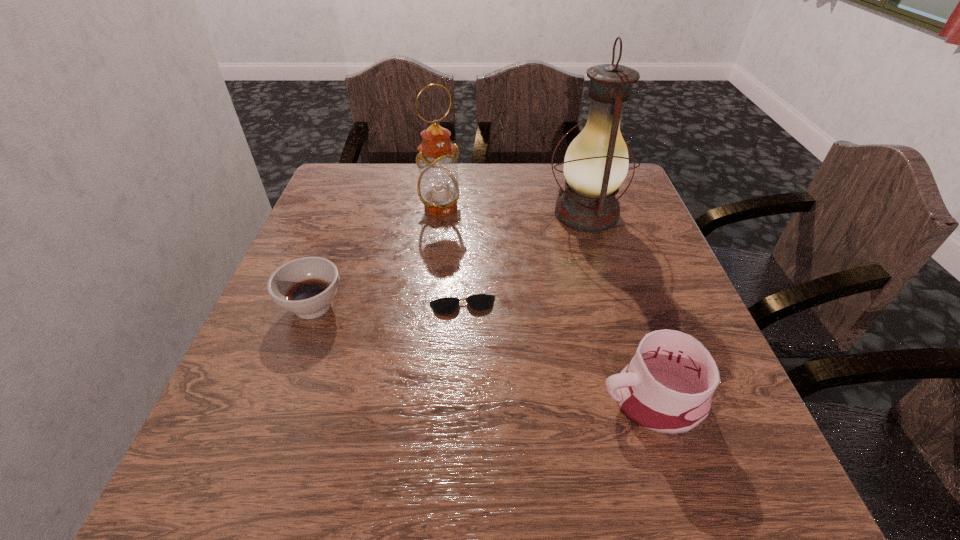
Where is `free space located 0.130m on the front of the shorter oil lamp`? free space located 0.130m on the front of the shorter oil lamp is located at coordinates (435, 252).

Locate an element on the screen. The image size is (960, 540). vacant region located 0.140m on the side with the handle of the third shortest object is located at coordinates (516, 400).

The width and height of the screenshot is (960, 540). In order to click on blank space located on the side with the handle of the third shortest object in this screenshot , I will do `click(534, 400)`.

Find the location of a particular element. Image resolution: width=960 pixels, height=540 pixels. vacant position located 0.350m on the side with the handle of the third shortest object is located at coordinates (390, 400).

Locate an element on the screen. Image resolution: width=960 pixels, height=540 pixels. vacant space located on the back of the fourth tallest object is located at coordinates (343, 227).

Identify the location of free space located on the front of the shortest object. This screenshot has height=540, width=960. (459, 392).

The image size is (960, 540). In order to click on object positioned at the left edge in this screenshot , I will do `click(306, 286)`.

Where is `oil lamp positioned at the right edge`? oil lamp positioned at the right edge is located at coordinates (596, 163).

The image size is (960, 540). I want to click on mug located at the right edge, so click(667, 387).

Find the location of a particular element. object at the far right corner is located at coordinates (596, 163).